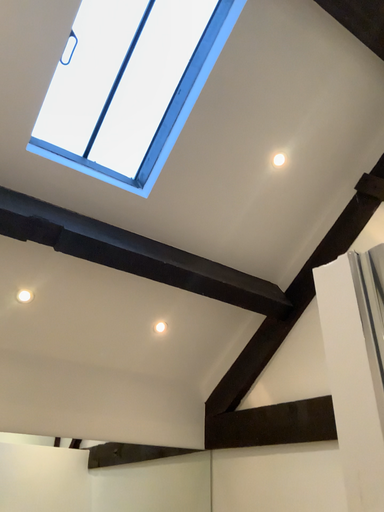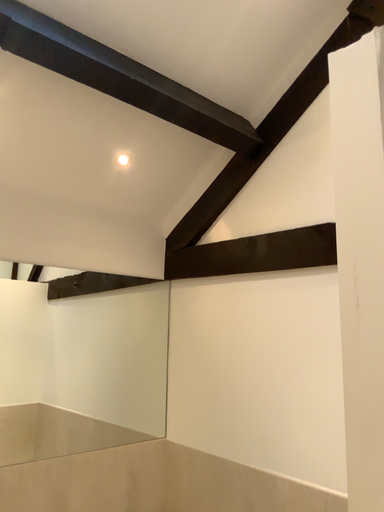
Question: How did the camera likely rotate when shooting the video?

Choices:
 (A) rotated upward
 (B) rotated downward

Answer: (B)